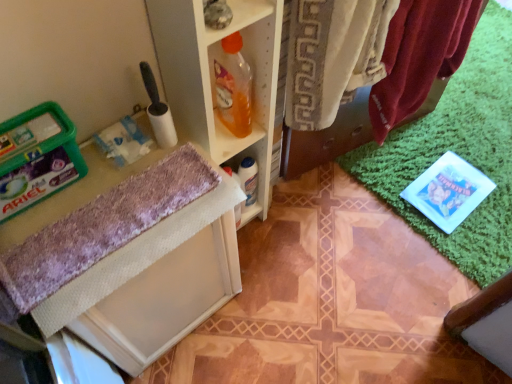
Question: Considering the relative sizes of purple fuzzy bath towel at lower left and velvet-like red towel at upper right in the image provided, is purple fuzzy bath towel at lower left thinner than velvet-like red towel at upper right?

Choices:
 (A) no
 (B) yes

Answer: (B)

Question: Could you tell me if purple fuzzy bath towel at lower left is facing velvet-like red towel at upper right?

Choices:
 (A) yes
 (B) no

Answer: (B)

Question: Is purple fuzzy bath towel at lower left smaller than velvet-like red towel at upper right?

Choices:
 (A) yes
 (B) no

Answer: (A)

Question: Can you confirm if purple fuzzy bath towel at lower left is taller than velvet-like red towel at upper right?

Choices:
 (A) yes
 (B) no

Answer: (B)

Question: Is purple fuzzy bath towel at lower left positioned in front of velvet-like red towel at upper right?

Choices:
 (A) no
 (B) yes

Answer: (B)

Question: From a real-world perspective, is translucent orange liquid at shelf center positioned above or below velvet-like red towel at upper right?

Choices:
 (A) above
 (B) below

Answer: (A)

Question: Relative to velvet-like red towel at upper right, is translucent orange liquid at shelf center in front or behind?

Choices:
 (A) behind
 (B) front

Answer: (A)

Question: Visually, is translucent orange liquid at shelf center positioned to the left or to the right of velvet-like red towel at upper right?

Choices:
 (A) left
 (B) right

Answer: (A)

Question: Is point (236, 100) closer or farther from the camera than point (284, 168)?

Choices:
 (A) farther
 (B) closer

Answer: (B)

Question: Considering the positions of velvet-like red towel at upper right and translucent orange liquid at shelf center in the image, is velvet-like red towel at upper right wider or thinner than translucent orange liquid at shelf center?

Choices:
 (A) wide
 (B) thin

Answer: (A)

Question: From the image's perspective, relative to translucent orange liquid at shelf center, is velvet-like red towel at upper right above or below?

Choices:
 (A) above
 (B) below

Answer: (B)

Question: Is velvet-like red towel at upper right in front of or behind translucent orange liquid at shelf center in the image?

Choices:
 (A) behind
 (B) front

Answer: (B)

Question: From a real-world perspective, is velvet-like red towel at upper right physically located above or below translucent orange liquid at shelf center?

Choices:
 (A) above
 (B) below

Answer: (B)

Question: In the image, is purple fuzzy bath towel at lower left on the left side or the right side of velvet-like red towel at upper right?

Choices:
 (A) left
 (B) right

Answer: (A)

Question: In terms of width, does purple fuzzy bath towel at lower left look wider or thinner when compared to velvet-like red towel at upper right?

Choices:
 (A) thin
 (B) wide

Answer: (A)